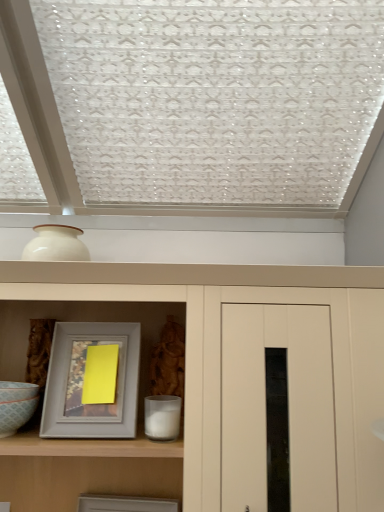
Question: Is matte white cupboard at center far from matte gray picture frame at lower center, the second picture frame viewed from the top?

Choices:
 (A) yes
 (B) no

Answer: (B)

Question: Is matte white cupboard at center placed right next to matte gray picture frame at lower center, the 1th picture frame positioned from the bottom?

Choices:
 (A) no
 (B) yes

Answer: (A)

Question: Is matte white cupboard at center facing towards matte gray picture frame at lower center, the second picture frame viewed from the top?

Choices:
 (A) no
 (B) yes

Answer: (A)

Question: From the image's perspective, would you say matte white cupboard at center is shown under matte gray picture frame at lower center, the 1th picture frame positioned from the bottom?

Choices:
 (A) no
 (B) yes

Answer: (A)

Question: Is matte white cupboard at center at the left side of matte gray picture frame at lower center, the second picture frame viewed from the top?

Choices:
 (A) no
 (B) yes

Answer: (A)

Question: Can you confirm if matte white cupboard at center is wider than matte gray picture frame at lower center, the 1th picture frame positioned from the bottom?

Choices:
 (A) yes
 (B) no

Answer: (A)

Question: Is matte gray picture frame at lower center, the second picture frame viewed from the top, positioned with its back to matte white cupboard at center?

Choices:
 (A) no
 (B) yes

Answer: (A)

Question: Can you confirm if matte gray picture frame at lower center, the 1th picture frame positioned from the bottom, is wider than matte white cupboard at center?

Choices:
 (A) no
 (B) yes

Answer: (A)

Question: Is matte gray picture frame at lower center, the second picture frame viewed from the top, thinner than matte white cupboard at center?

Choices:
 (A) no
 (B) yes

Answer: (B)

Question: Does matte gray picture frame at lower center, the second picture frame viewed from the top, come in front of matte white cupboard at center?

Choices:
 (A) no
 (B) yes

Answer: (A)

Question: Can you see matte gray picture frame at lower center, the 1th picture frame positioned from the bottom, touching matte white cupboard at center?

Choices:
 (A) yes
 (B) no

Answer: (B)

Question: Does matte gray picture frame at lower center, the 1th picture frame positioned from the bottom, have a smaller size compared to matte white cupboard at center?

Choices:
 (A) yes
 (B) no

Answer: (A)

Question: Does gray matte picture frame at center, which is counted as the 2th picture frame, starting from the bottom, contain matte gray picture frame at lower center, the 1th picture frame positioned from the bottom?

Choices:
 (A) no
 (B) yes

Answer: (A)